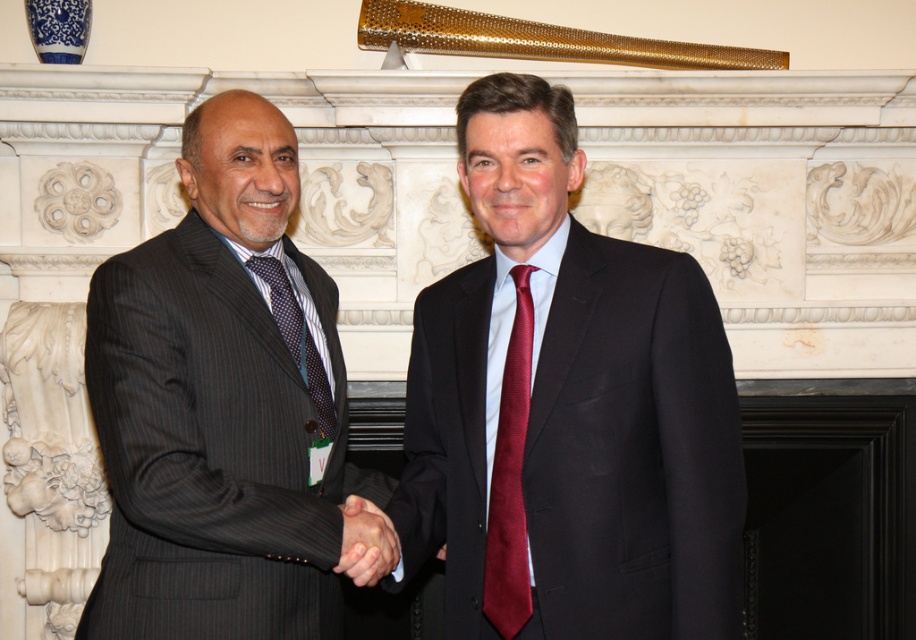
You are a fashion designer observing two men in suits at a formal event. You notice the matte black suit at center and the smooth black suit at center. Which of these two suits has a larger size?

The matte black suit at center has a larger size compared to the smooth black suit at center.

You are a fashion designer observing two men in suits. You need to determine which item is wider between the dark pinstripe suit at left and the dark blue textured tie at left. Which one is wider?

The dark pinstripe suit at left is wider than the dark blue textured tie at left according to the description.